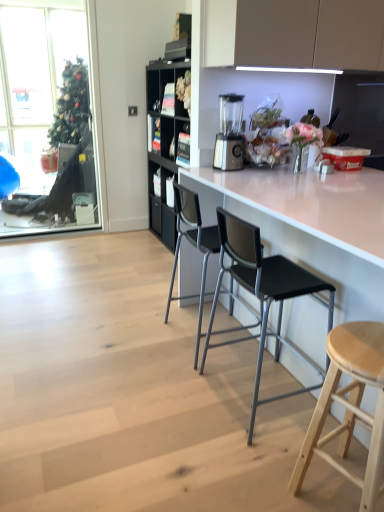
Describe the element at coordinates (193, 246) in the screenshot. I see `black plastic chair at center, the 1th chair in the back-to-front sequence` at that location.

Image resolution: width=384 pixels, height=512 pixels. I want to click on light wood stool at lower right, so click(x=349, y=404).

Is clear glass window at upper left taller or shorter than black plastic chair at center, which is the 2th chair from front to back?

clear glass window at upper left is taller than black plastic chair at center, which is the 2th chair from front to back.

From the image's perspective, between clear glass window at upper left and black plastic chair at center, the 1th chair in the back-to-front sequence, who is located below?

black plastic chair at center, the 1th chair in the back-to-front sequence, from the image's perspective.

Consider the image. Is clear glass window at upper left at the right side of black plastic chair at center, the 1th chair in the back-to-front sequence?

No, clear glass window at upper left is not to the right of black plastic chair at center, the 1th chair in the back-to-front sequence.

Is clear glass window at upper left in front of black plastic chair at center, which is the 2th chair from front to back?

No, clear glass window at upper left is behind black plastic chair at center, which is the 2th chair from front to back.

Based on the photo, is satin silver blender at center next to black plastic chair at center, the second chair from the back, and touching it?

satin silver blender at center and black plastic chair at center, the second chair from the back, are not in contact.

Which object is positioned more to the left, satin silver blender at center or black plastic chair at center, acting as the 1th chair starting from the front?

Positioned to the left is satin silver blender at center.

How different are the orientations of satin silver blender at center and black plastic chair at center, acting as the 1th chair starting from the front, in degrees?

They differ by 75.8 degrees in their facing directions.

From a real-world perspective, does satin silver blender at center stand above black plastic chair at center, acting as the 1th chair starting from the front?

Indeed, from a real-world perspective, satin silver blender at center stands above black plastic chair at center, acting as the 1th chair starting from the front.

In the scene shown: Can you tell me how much white glossy counter at center and light wood stool at lower right differ in facing direction?

white glossy counter at center and light wood stool at lower right are facing 4.94 degrees away from each other.

Based on the photo, is white glossy counter at center situated inside light wood stool at lower right or outside?

white glossy counter at center lies outside light wood stool at lower right.

Does point (343, 298) appear closer or farther from the camera than point (365, 483)?

Point (343, 298) is positioned farther from the camera compared to point (365, 483).

Can you confirm if white glossy counter at center is bigger than light wood stool at lower right?

Yes.

Can we say black plastic chair at center, the 1th chair in the back-to-front sequence, lies outside white glossy counter at center?

No.

Which of these two, black plastic chair at center, the 1th chair in the back-to-front sequence, or white glossy counter at center, stands shorter?

black plastic chair at center, the 1th chair in the back-to-front sequence, is shorter.

From the image's perspective, would you say black plastic chair at center, which is the 2th chair from front to back, is shown under white glossy counter at center?

No.

Is black plastic chair at center, which is the 2th chair from front to back, at the left side of white glossy counter at center?

Yes.

Considering the sizes of objects black plastic chair at center, the second chair from the back, and black plastic chair at center, the 1th chair in the back-to-front sequence, in the image provided, who is smaller, black plastic chair at center, the second chair from the back, or black plastic chair at center, the 1th chair in the back-to-front sequence,?

With smaller size is black plastic chair at center, the second chair from the back.

I want to click on chair positioned vertically above the black plastic chair at center, the second chair from the back (from a real-world perspective), so click(193, 246).

Between white glossy counter at center and black plastic chair at center, the 1th chair in the back-to-front sequence, which one has less height?

black plastic chair at center, the 1th chair in the back-to-front sequence, is shorter.

Is the surface of white glossy counter at center in direct contact with black plastic chair at center, the 1th chair in the back-to-front sequence?

No, white glossy counter at center is not next to black plastic chair at center, the 1th chair in the back-to-front sequence.

Is black plastic chair at center, which is the 2th chair from front to back, a part of white glossy counter at center?

Yes, white glossy counter at center is surrounding black plastic chair at center, which is the 2th chair from front to back.

Could you measure the distance between white glossy counter at center and black plastic chair at center, the 1th chair in the back-to-front sequence?

Answer: A distance of 15.28 inches exists between white glossy counter at center and black plastic chair at center, the 1th chair in the back-to-front sequence.

Is clear glass window at upper left beside satin silver blender at center?

No, clear glass window at upper left is not beside satin silver blender at center.

Is clear glass window at upper left taller than satin silver blender at center?

Indeed, clear glass window at upper left has a greater height compared to satin silver blender at center.

From a real-world perspective, is clear glass window at upper left physically below satin silver blender at center?

Yes.

From the image's perspective, which chair is the 1st one below the clear glass window at upper left? Please provide its 2D coordinates.

[(193, 246)]

Identify the location of appliance above the black plastic chair at center, acting as the 1th chair starting from the front (from a real-world perspective). This screenshot has height=512, width=384. (229, 134).

Estimate the real-world distances between objects in this image. Which object is further from clear glass window at upper left, light wood stool at lower right or black plastic chair at center, which is the 2th chair from front to back?

Based on the image, light wood stool at lower right appears to be further to clear glass window at upper left.

Considering their positions, is satin silver blender at center positioned further to clear glass window at upper left than white glossy counter at center?

satin silver blender at center lies further to clear glass window at upper left than the other object.

When comparing their distances from satin silver blender at center, does clear glass window at upper left or white glossy counter at center seem closer?

Based on the image, white glossy counter at center appears to be nearer to satin silver blender at center.

Estimate the real-world distances between objects in this image. Which object is closer to light wood stool at lower right, white glossy counter at center or black plastic chair at center, which is the 2th chair from front to back?

Based on the image, white glossy counter at center appears to be nearer to light wood stool at lower right.

Based on their spatial positions, is black plastic chair at center, the second chair from the back, or satin silver blender at center further from black plastic chair at center, which is the 2th chair from front to back?

Based on the image, satin silver blender at center appears to be further to black plastic chair at center, which is the 2th chair from front to back.

Based on their spatial positions, is light wood stool at lower right or satin silver blender at center further from black plastic chair at center, the second chair from the back?

Among the two, satin silver blender at center is located further to black plastic chair at center, the second chair from the back.

Based on their spatial positions, is black plastic chair at center, which is the 2th chair from front to back, or black plastic chair at center, the second chair from the back, closer to white glossy counter at center?

Based on the image, black plastic chair at center, the second chair from the back, appears to be nearer to white glossy counter at center.

From the image, which object appears to be farther from black plastic chair at center, acting as the 1th chair starting from the front, black plastic chair at center, the 1th chair in the back-to-front sequence, or light wood stool at lower right?

Based on the image, light wood stool at lower right appears to be further to black plastic chair at center, acting as the 1th chair starting from the front.

This screenshot has width=384, height=512. In order to click on chair located between white glossy counter at center and black plastic chair at center, which is the 2th chair from front to back, in the depth direction in this screenshot , I will do `click(264, 295)`.

The width and height of the screenshot is (384, 512). In order to click on stool located between white glossy counter at center and clear glass window at upper left in the depth direction in this screenshot , I will do `click(349, 404)`.

At what (x,y) coordinates should I click in order to perform the action: click on chair that lies between satin silver blender at center and black plastic chair at center, acting as the 1th chair starting from the front, from top to bottom. Please return your answer as a coordinate pair (x, y). Looking at the image, I should click on (193, 246).

You are a GUI agent. You are given a task and a screenshot of the screen. Output one action in this format:
    pyautogui.click(x=<x>, y=<y>)
    Task: Click on the chair between black plastic chair at center, acting as the 1th chair starting from the front, and clear glass window at upper left, along the z-axis
    The image size is (384, 512).
    Given the screenshot: What is the action you would take?
    pyautogui.click(x=193, y=246)